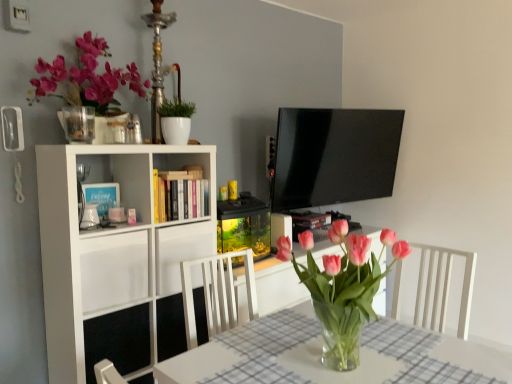
Question: Is white matte cabinet at left, the first cabinet in the left-to-right sequence, positioned far away from white matte cabinet at center, which is the first cabinet from right to left?

Choices:
 (A) no
 (B) yes

Answer: (A)

Question: Does white matte cabinet at left, the first cabinet in the left-to-right sequence, come behind white matte cabinet at center, marked as the second cabinet in a left-to-right arrangement?

Choices:
 (A) no
 (B) yes

Answer: (A)

Question: Is white matte cabinet at left, the first cabinet in the left-to-right sequence, outside white matte cabinet at center, which is the first cabinet from right to left?

Choices:
 (A) no
 (B) yes

Answer: (B)

Question: Is white matte cabinet at left, acting as the second cabinet starting from the right, beside white matte cabinet at center, marked as the second cabinet in a left-to-right arrangement?

Choices:
 (A) no
 (B) yes

Answer: (A)

Question: Is white matte cabinet at left, the first cabinet in the left-to-right sequence, aimed at white matte cabinet at center, marked as the second cabinet in a left-to-right arrangement?

Choices:
 (A) yes
 (B) no

Answer: (B)

Question: Which is correct: white matte cabinet at left, the first cabinet in the left-to-right sequence, is inside pink glass vase at center, or outside of it?

Choices:
 (A) inside
 (B) outside

Answer: (B)

Question: From the image's perspective, is white matte cabinet at left, acting as the second cabinet starting from the right, above or below pink glass vase at center?

Choices:
 (A) below
 (B) above

Answer: (A)

Question: Looking at the image, does white matte cabinet at left, the first cabinet in the left-to-right sequence, seem bigger or smaller compared to pink glass vase at center?

Choices:
 (A) big
 (B) small

Answer: (B)

Question: Is point (123, 253) positioned closer to the camera than point (333, 291)?

Choices:
 (A) closer
 (B) farther

Answer: (B)

Question: Looking at the image, does matte pink flowers at upper left seem bigger or smaller compared to white matte cabinet at left, acting as the second cabinet starting from the right?

Choices:
 (A) big
 (B) small

Answer: (A)

Question: Is matte pink flowers at upper left to the left or to the right of white matte cabinet at left, the first cabinet in the left-to-right sequence, in the image?

Choices:
 (A) left
 (B) right

Answer: (A)

Question: Considering the positions of matte pink flowers at upper left and white matte cabinet at left, the first cabinet in the left-to-right sequence, in the image, is matte pink flowers at upper left wider or thinner than white matte cabinet at left, the first cabinet in the left-to-right sequence,?

Choices:
 (A) thin
 (B) wide

Answer: (A)

Question: From the image's perspective, is matte pink flowers at upper left located above or below white matte cabinet at left, acting as the second cabinet starting from the right?

Choices:
 (A) above
 (B) below

Answer: (A)

Question: From the image's perspective, is white glossy pot at upper center positioned above or below pink glass vase at center?

Choices:
 (A) above
 (B) below

Answer: (A)

Question: Considering the positions of point (179, 112) and point (348, 340), is point (179, 112) closer or farther from the camera than point (348, 340)?

Choices:
 (A) farther
 (B) closer

Answer: (A)